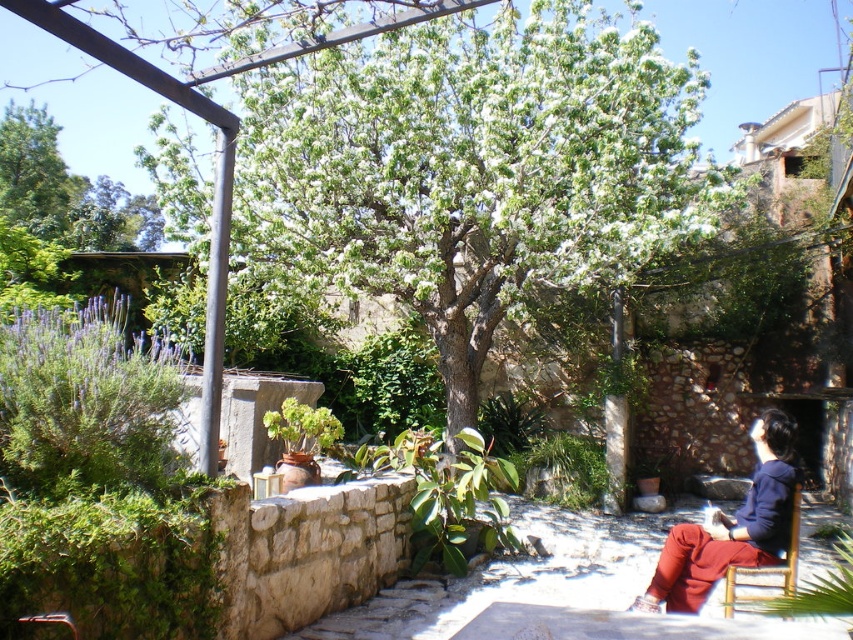
Is the position of dark blue hoodie at lower right less distant than that of wooden chair at lower right?

No.

What do you see at coordinates (730, 525) in the screenshot? The image size is (853, 640). I see `dark blue hoodie at lower right` at bounding box center [730, 525].

The width and height of the screenshot is (853, 640). What are the coordinates of `dark blue hoodie at lower right` in the screenshot? It's located at (730, 525).

Does green leafy tree at center lie in front of dark blue hoodie at lower right?

No, it is behind dark blue hoodie at lower right.

Who is higher up, green leafy tree at center or dark blue hoodie at lower right?

A: Positioned higher is green leafy tree at center.

You are a GUI agent. You are given a task and a screenshot of the screen. Output one action in this format:
    pyautogui.click(x=<x>, y=<y>)
    Task: Click on the green leafy tree at center
    This screenshot has height=640, width=853.
    Given the screenshot: What is the action you would take?
    pyautogui.click(x=474, y=170)

Is green leafy tree at center in front of wooden chair at lower right?

That is False.

Is green leafy tree at center below wooden chair at lower right?

Incorrect, green leafy tree at center is not positioned below wooden chair at lower right.

Describe the element at coordinates (474, 170) in the screenshot. I see `green leafy tree at center` at that location.

Locate an element on the screen. This screenshot has height=640, width=853. green leafy tree at center is located at coordinates coord(474,170).